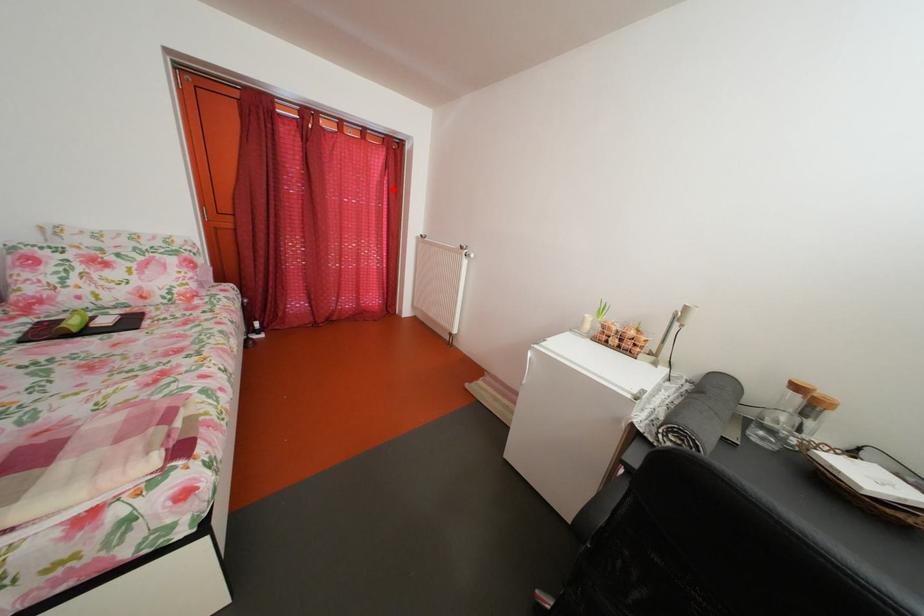
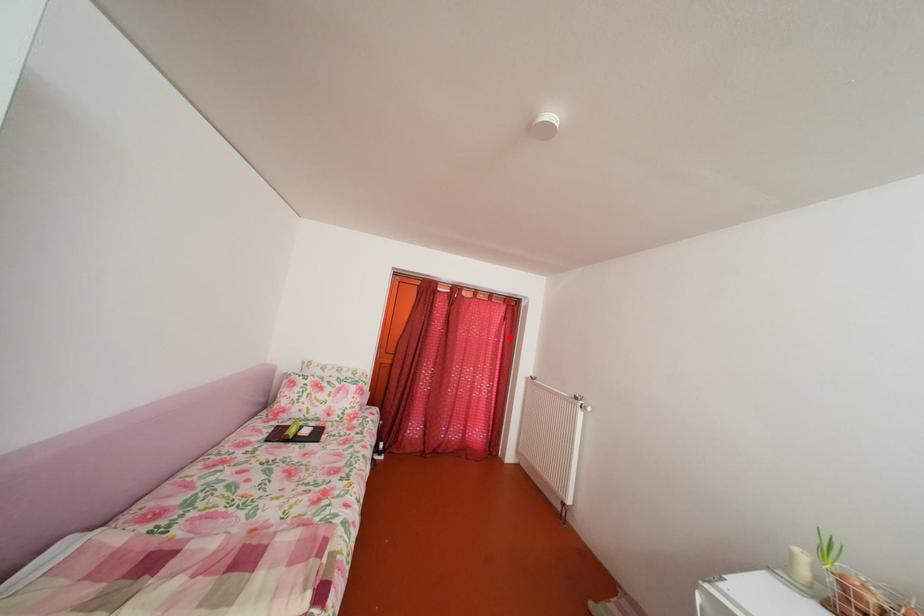
I am providing you with two images of the same scene from different viewpoints. A red point is marked on the first image and another point is marked on the second image. Is the red point in image1 aligned with the point shown in image2?

Yes